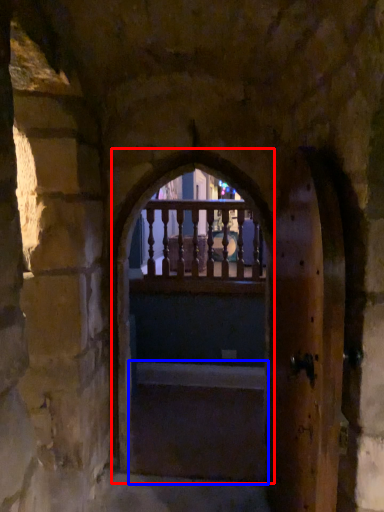
Question: Which point is closer to the camera, window frame (highlighted by a red box) or stairs (highlighted by a blue box)?

Choices:
 (A) window frame
 (B) stairs

Answer: (A)